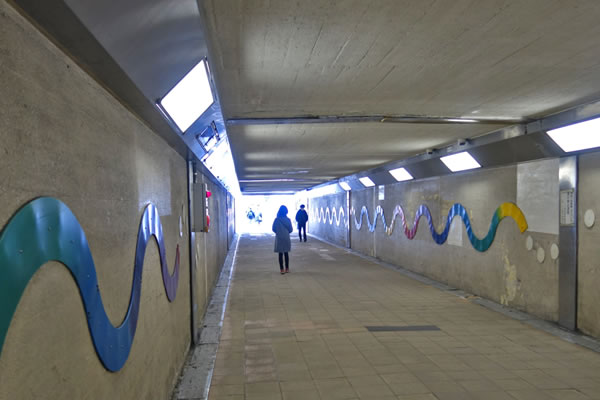
Locate an element on the screen. The width and height of the screenshot is (600, 400). artwork going down wall is located at coordinates (479, 243), (336, 220), (108, 327).